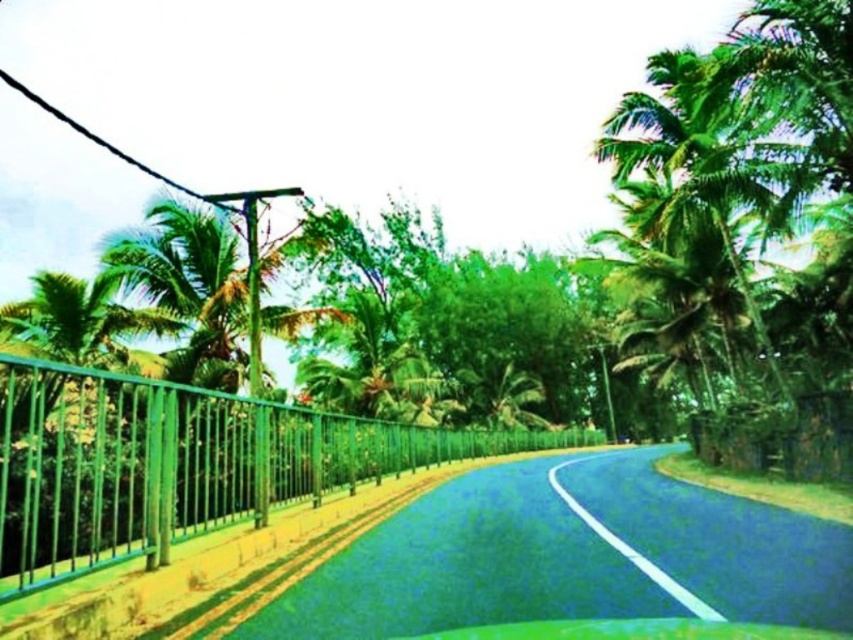
Can you confirm if green metal fence at left is wider than green leafy palm tree at upper right?

Correct, the width of green metal fence at left exceeds that of green leafy palm tree at upper right.

Does green metal fence at left have a greater height compared to green leafy palm tree at upper right?

In fact, green metal fence at left may be shorter than green leafy palm tree at upper right.

Who is more forward, (473,442) or (685,125)?

Point (685,125)

Find the location of a particular element. green metal fence at left is located at coordinates (180, 464).